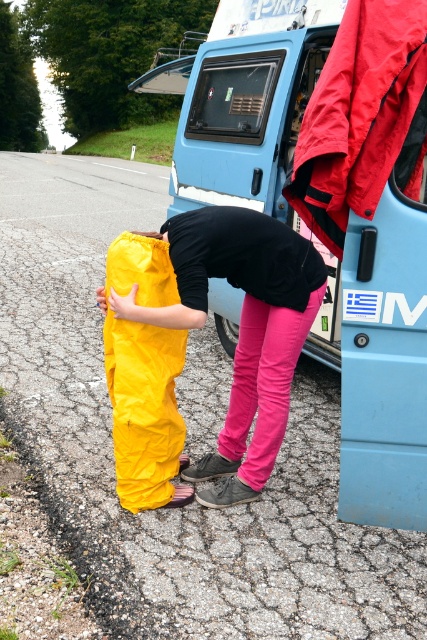
You are a delivery person needing to reach the blue matte van at center from where you are standing near the yellow waterproof pants at lower left. Can you comfortably walk to the van without needing to move any objects in your path?

The blue matte van at center is 6.50 feet away from the yellow waterproof pants at lower left. Since the distance is sufficient for comfortable walking and there are no mentioned obstacles, you can walk to the van without issues.

You are a pedestrian trying to cross the road safely. You see the blue matte van at center and the yellow waterproof pants at center in your path. Which object is closer to you, and would you need to step around it first?

The blue matte van at center is closer to you than the yellow waterproof pants at center. You should step around the blue matte van at center first since it is nearer in your path.